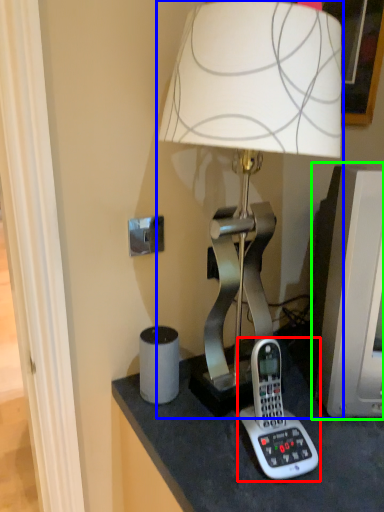
Question: Based on their relative distances, which object is nearer to corded phone (highlighted by a red box)? Choose from lamp (highlighted by a blue box) and computer monitor (highlighted by a green box).

Choices:
 (A) lamp
 (B) computer monitor

Answer: (B)